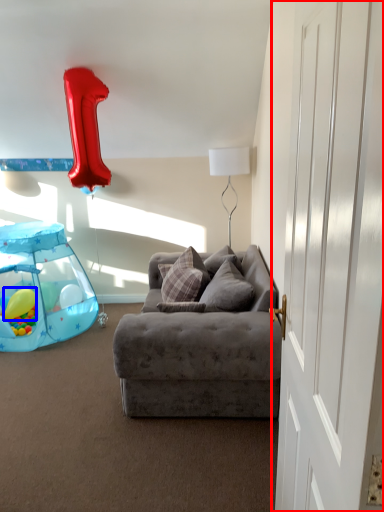
Question: Among these objects, which one is nearest to the camera, door (highlighted by a red box) or balloon (highlighted by a blue box)?

Choices:
 (A) door
 (B) balloon

Answer: (A)